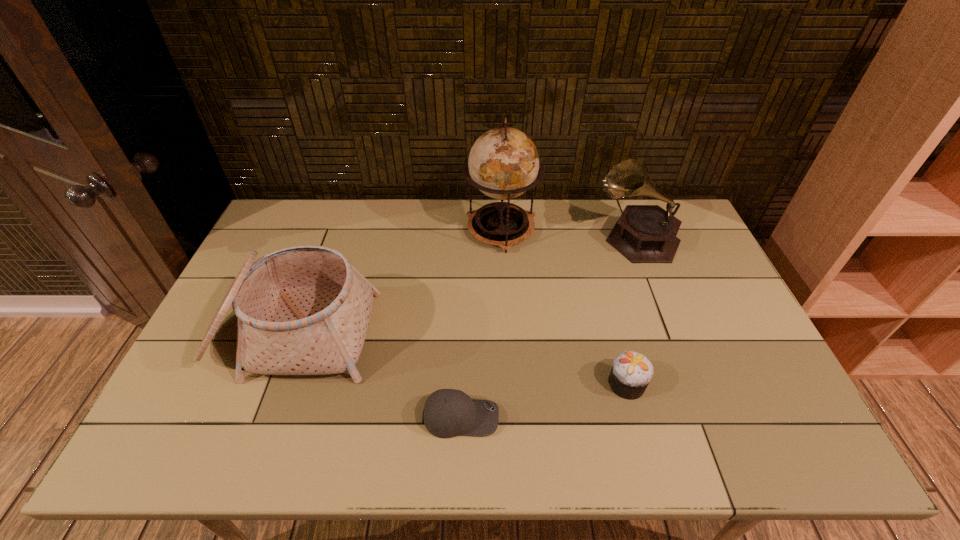
In order to click on the tallest object in this screenshot , I will do `click(503, 163)`.

I want to click on phonograph record, so click(644, 233).

The image size is (960, 540). I want to click on the leftmost object, so click(x=303, y=310).

Locate an element on the screen. This screenshot has width=960, height=540. cupcake is located at coordinates (631, 373).

Find the location of `the shortest object`. the shortest object is located at coordinates (447, 413).

Where is `vacant space located at the center of the tallest object`? vacant space located at the center of the tallest object is located at coordinates (505, 307).

The width and height of the screenshot is (960, 540). I want to click on free space located on the horn direction of the phonograph record, so click(x=511, y=238).

Locate an element on the screen. This screenshot has width=960, height=540. vacant region located on the horn direction of the phonograph record is located at coordinates (499, 238).

The image size is (960, 540). I want to click on vacant space located on the horn direction of the phonograph record, so click(531, 238).

You are a GUI agent. You are given a task and a screenshot of the screen. Output one action in this format:
    pyautogui.click(x=<x>, y=<y>)
    Task: Click on the free location located 0.080m with the lid open on the basket
    The image size is (960, 540).
    Given the screenshot: What is the action you would take?
    pyautogui.click(x=262, y=415)